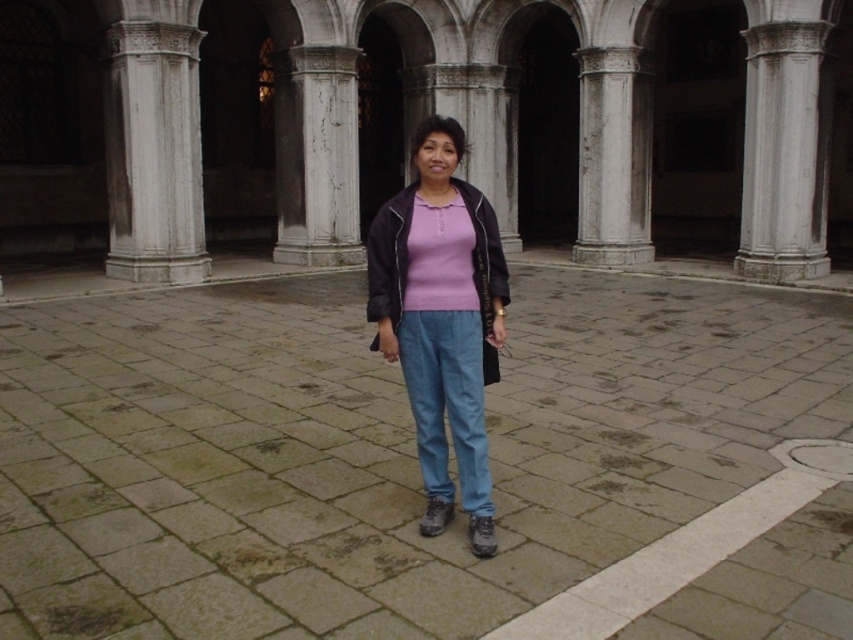
Image resolution: width=853 pixels, height=640 pixels. Find the location of `matte pink shirt at center`. matte pink shirt at center is located at coordinates (440, 320).

Does matte pink shirt at center have a lesser width compared to white marble column at center?

Yes.

Is point (422, 124) positioned after point (624, 244)?

No, (422, 124) is closer to viewer.

Where is `matte pink shirt at center`? The image size is (853, 640). matte pink shirt at center is located at coordinates (440, 320).

Which of these two, matte pink shirt at center or matte black jacket at center, stands taller?

matte black jacket at center

Does matte pink shirt at center appear on the left side of matte black jacket at center?

In fact, matte pink shirt at center is to the right of matte black jacket at center.

Is point (483, 234) less distant than point (387, 273)?

Yes, point (483, 234) is closer to viewer.

Locate an element on the screen. This screenshot has width=853, height=640. matte pink shirt at center is located at coordinates (440, 320).

How much distance is there between white stone column at center and white marble column at center?

A distance of 2.72 meters exists between white stone column at center and white marble column at center.

Is point (787, 60) positioned before point (599, 65)?

Yes, point (787, 60) is in front of point (599, 65).

I want to click on white stone column at center, so click(x=786, y=138).